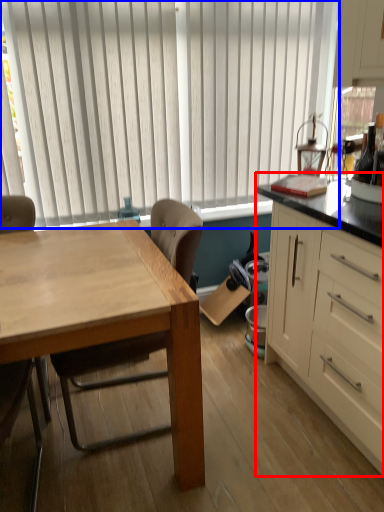
Question: Which of the following is the farthest to the observer, cabinetry (highlighted by a red box) or window blind (highlighted by a blue box)?

Choices:
 (A) cabinetry
 (B) window blind

Answer: (B)